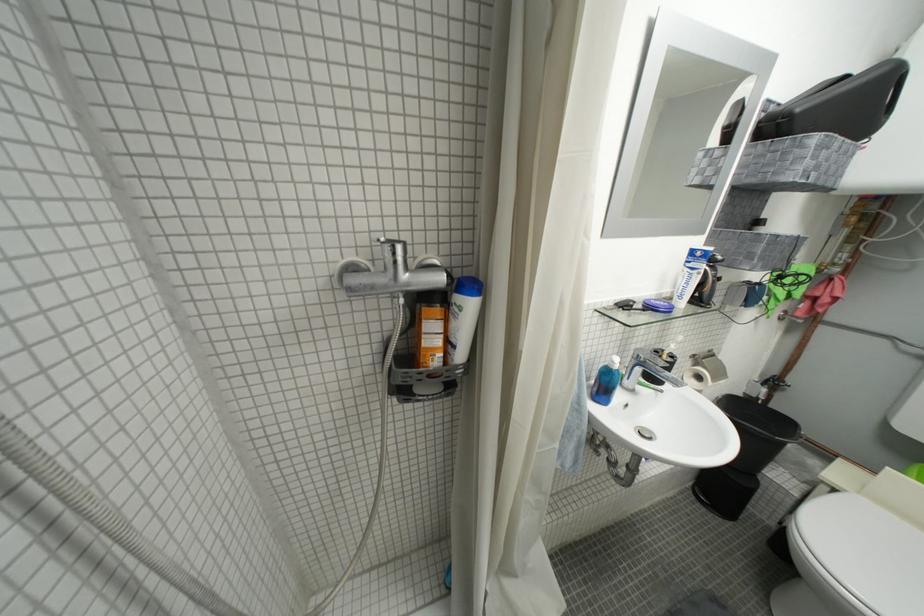
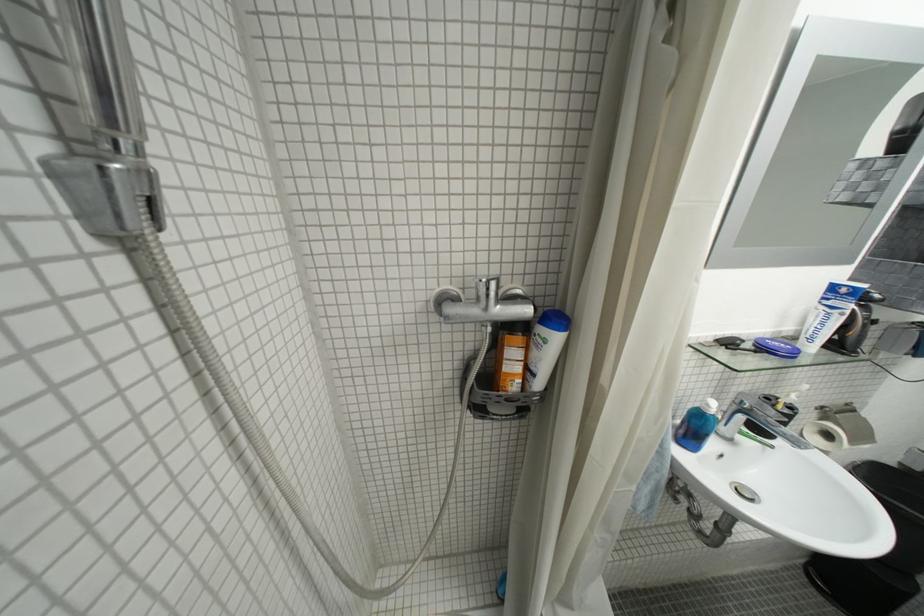
In the second image, find the point that corresponds to (x=481, y=299) in the first image.

(567, 333)